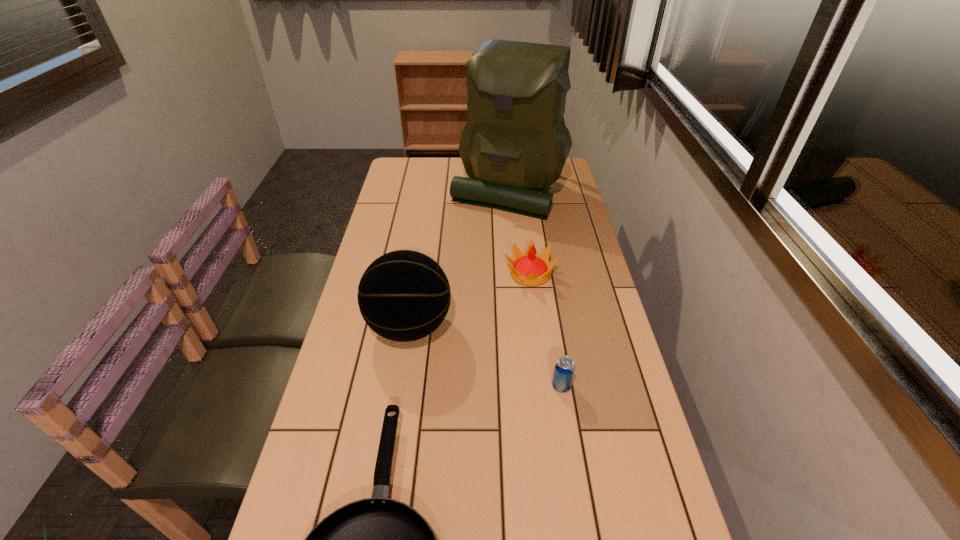
This screenshot has height=540, width=960. I want to click on backpack, so click(x=514, y=145).

Image resolution: width=960 pixels, height=540 pixels. I want to click on the tallest object, so click(x=514, y=145).

You are a GUI agent. You are given a task and a screenshot of the screen. Output one action in this format:
    pyautogui.click(x=<x>, y=<y>)
    Task: Click on the third nearest object
    
    Given the screenshot: What is the action you would take?
    pyautogui.click(x=404, y=295)

At what (x,y) coordinates should I click in order to perform the action: click on basketball. Please return your answer as a coordinate pair (x, y). The image size is (960, 540). Looking at the image, I should click on (404, 295).

The image size is (960, 540). I want to click on the fourth nearest object, so click(529, 269).

Image resolution: width=960 pixels, height=540 pixels. Identify the location of crown. (529, 269).

Find the location of a particular element. the second shortest object is located at coordinates (564, 369).

The width and height of the screenshot is (960, 540). Find the location of `the fourth farthest object`. the fourth farthest object is located at coordinates (564, 369).

Identify the location of vacant area situated 0.230m on the front of the backpack with visible pockets. The width and height of the screenshot is (960, 540). (515, 262).

Locate an element on the screen. vacant point located 0.370m on the back of the third nearest object is located at coordinates (425, 225).